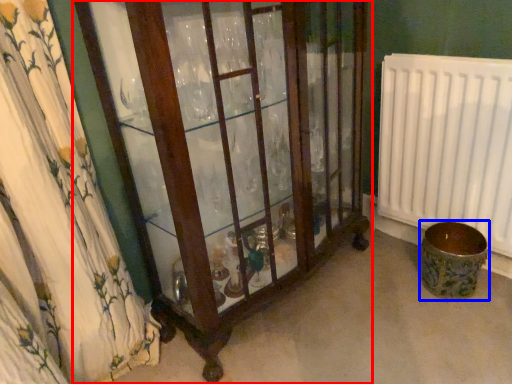
Question: Which of the following is the farthest to the observer, furniture (highlighted by a red box) or toilet bowl (highlighted by a blue box)?

Choices:
 (A) furniture
 (B) toilet bowl

Answer: (B)